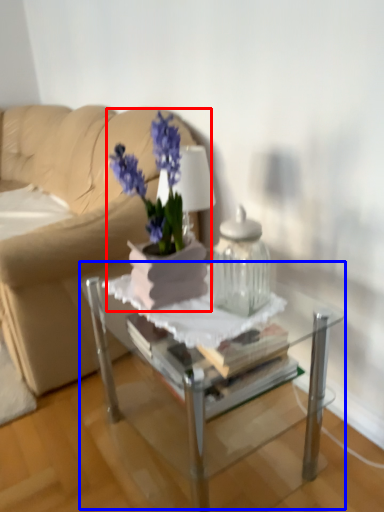
Question: Which object is further to the camera taking this photo, houseplant (highlighted by a red box) or table (highlighted by a blue box)?

Choices:
 (A) houseplant
 (B) table

Answer: (A)